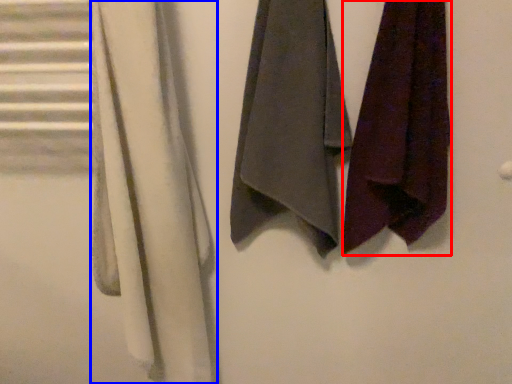
Question: Which object appears closest to the camera in this image, towel (highlighted by a red box) or cloth (highlighted by a blue box)?

Choices:
 (A) towel
 (B) cloth

Answer: (B)